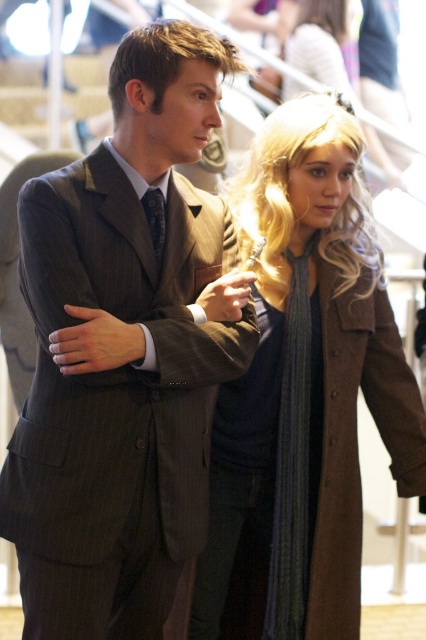
You are a tailor measuring the pinstriped wool suit at center and the brown wool coat at center for alterations. Which garment has a smaller width that requires less fabric?

The pinstriped wool suit at center has a smaller width than the brown wool coat at center, so it requires less fabric.

You are a photographer setting up for a group photo. You need to arrange the pinstriped wool suit at center and the brown wool coat at center so that they are facing each other. Based on their current positions, which one should move to the right to face the other?

The pinstriped wool suit at center should move to the right to face the brown wool coat at center because it is currently positioned on the left side of the brown wool coat at center.